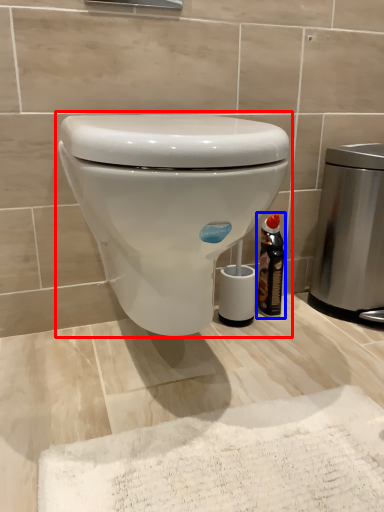
Question: Which object is closer to the camera taking this photo, toilet (highlighted by a red box) or bottle (highlighted by a blue box)?

Choices:
 (A) toilet
 (B) bottle

Answer: (A)